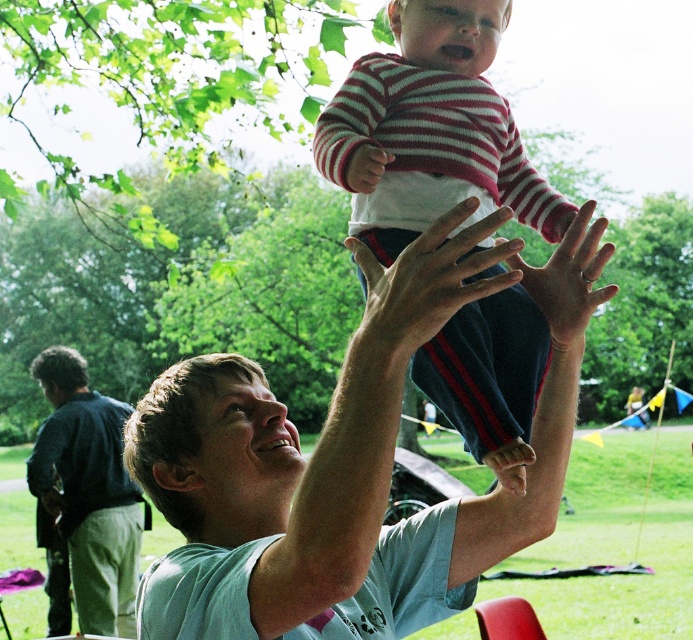
Based on the photo, who is positioned more to the right, striped cotton shirt at center or dark blue jeans at lower left?

From the viewer's perspective, striped cotton shirt at center appears more on the right side.

Does striped cotton shirt at center have a smaller size compared to dark blue jeans at lower left?

Indeed, striped cotton shirt at center has a smaller size compared to dark blue jeans at lower left.

This screenshot has width=693, height=640. What do you see at coordinates (430, 129) in the screenshot?
I see `striped cotton shirt at center` at bounding box center [430, 129].

Identify the location of striped cotton shirt at center. (430, 129).

Can you confirm if light blue t-shirt at center is taller than striped cotton shirt at center?

No, light blue t-shirt at center is not taller than striped cotton shirt at center.

Which is more to the right, light blue t-shirt at center or striped cotton shirt at center?

striped cotton shirt at center

Does point (301, 595) come closer to viewer compared to point (509, 358)?

Yes.

Identify the location of light blue t-shirt at center. (359, 464).

Is light blue t-shirt at center wider than dark blue jeans at lower left?

Indeed, light blue t-shirt at center has a greater width compared to dark blue jeans at lower left.

Is light blue t-shirt at center above dark blue jeans at lower left?

Yes.

Between point (509, 499) and point (91, 403), which one is positioned behind?

Positioned behind is point (91, 403).

In order to click on light blue t-shirt at center in this screenshot , I will do `click(359, 464)`.